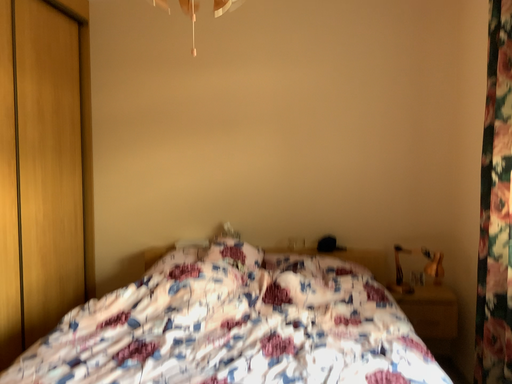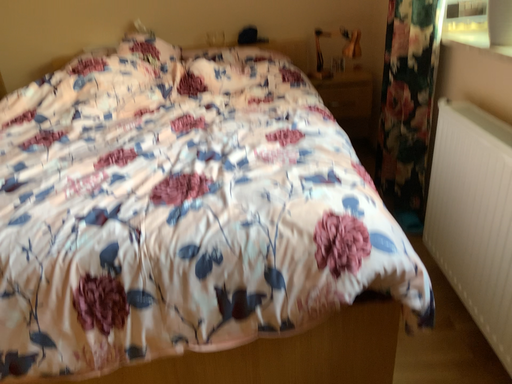
Question: How did the camera likely rotate when shooting the video?

Choices:
 (A) rotated upward
 (B) rotated downward

Answer: (B)